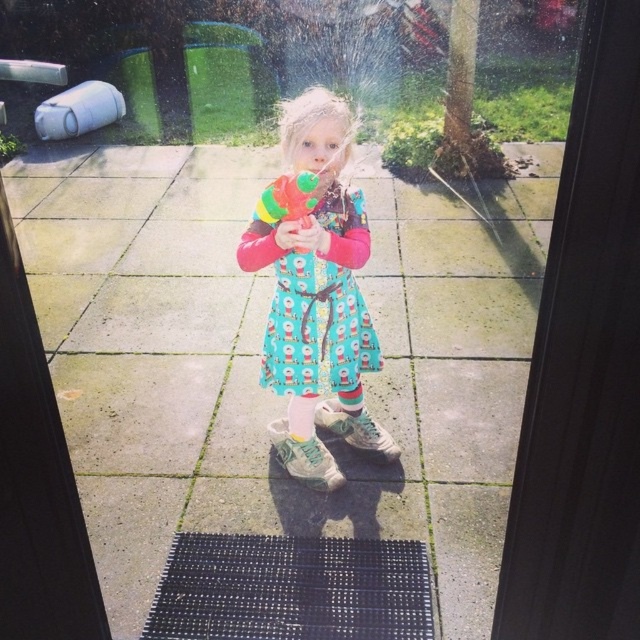
Can you confirm if turquoise fabric dress at center is positioned below cotton dress at center?

Actually, turquoise fabric dress at center is above cotton dress at center.

Does turquoise fabric dress at center appear over cotton dress at center?

Yes.

Is point (312, 481) less distant than point (280, 273)?

No, (312, 481) is further to viewer.

Where is `turquoise fabric dress at center`? Image resolution: width=640 pixels, height=640 pixels. turquoise fabric dress at center is located at coordinates (317, 298).

What do you see at coordinates (584, 371) in the screenshot? I see `transparent glass screen door at upper right` at bounding box center [584, 371].

Between transparent glass screen door at upper right and cotton dress at center, which one has more height?

transparent glass screen door at upper right is taller.

Is point (608, 248) behind point (353, 317)?

No, it is not.

The image size is (640, 640). Identify the location of transparent glass screen door at upper right. (584, 371).

This screenshot has height=640, width=640. Describe the element at coordinates (584, 371) in the screenshot. I see `transparent glass screen door at upper right` at that location.

Is point (602, 384) closer to viewer compared to point (300, 221)?

Yes.

The height and width of the screenshot is (640, 640). I want to click on transparent glass screen door at upper right, so click(584, 371).